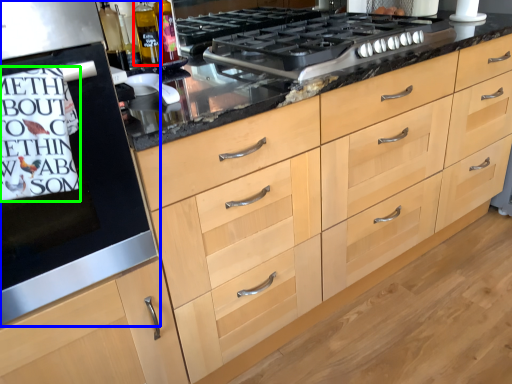
Question: Considering the real-world distances, which object is closest to bottle (highlighted by a red box)? home appliance (highlighted by a blue box) or writing (highlighted by a green box).

Choices:
 (A) home appliance
 (B) writing

Answer: (A)